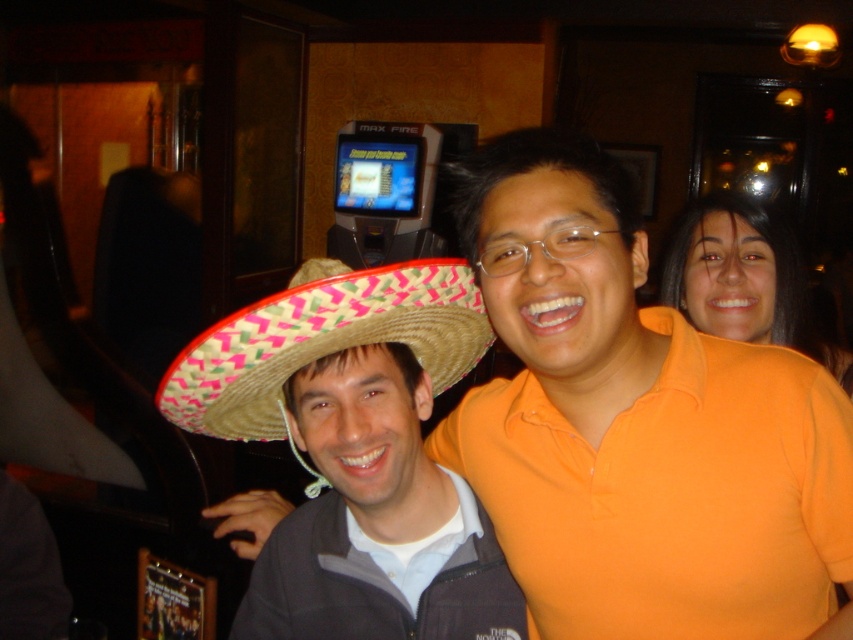
How much distance is there between straw hat at center and orange matte shirt at upper right?

The distance of straw hat at center from orange matte shirt at upper right is 32.24 inches.

Which is more to the left, straw hat at center or orange matte shirt at upper right?

straw hat at center is more to the left.

Where is `straw hat at center`? Image resolution: width=853 pixels, height=640 pixels. straw hat at center is located at coordinates (x=570, y=372).

Can you confirm if bright pink woven straw sombrero at center is wider than orange matte shirt at upper right?

Yes.

Can you confirm if bright pink woven straw sombrero at center is positioned below orange matte shirt at upper right?

Correct, bright pink woven straw sombrero at center is located below orange matte shirt at upper right.

Is point (386, 333) behind point (850, 390)?

No, it is not.

Find the location of a particular element. This screenshot has width=853, height=640. bright pink woven straw sombrero at center is located at coordinates (322, 342).

Can you confirm if straw hat at center is thinner than bright pink woven straw sombrero at center?

No, straw hat at center is not thinner than bright pink woven straw sombrero at center.

Is straw hat at center smaller than bright pink woven straw sombrero at center?

No, straw hat at center is not smaller than bright pink woven straw sombrero at center.

The height and width of the screenshot is (640, 853). Identify the location of straw hat at center. tap(570, 372).

The image size is (853, 640). Find the location of `straw hat at center`. straw hat at center is located at coordinates (570, 372).